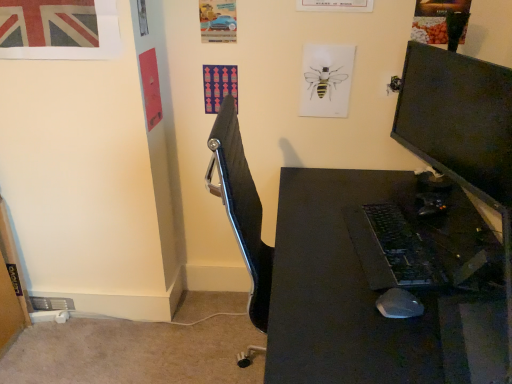
The height and width of the screenshot is (384, 512). Find the location of `free space above black plastic desk at center (from a real-world perspective)`. free space above black plastic desk at center (from a real-world perspective) is located at coordinates tap(399, 261).